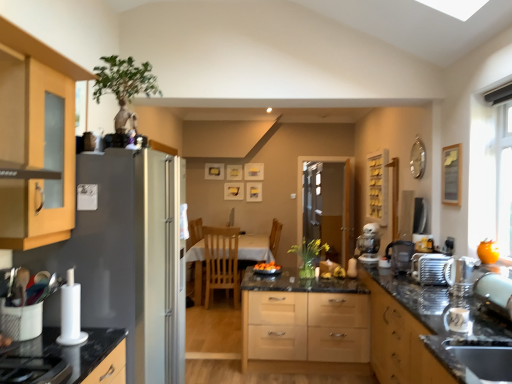
What do you see at coordinates (451, 174) in the screenshot? I see `wooden picture frame at upper right, positioned as the 1th picture frame in front-to-back order` at bounding box center [451, 174].

The height and width of the screenshot is (384, 512). Identify the location of white plastic coffee machine at right. (369, 244).

Describe the element at coordinates (255, 248) in the screenshot. This screenshot has height=384, width=512. I see `white glossy table at center` at that location.

In order to click on black granite toaster at right in this screenshot , I will do click(x=407, y=330).

The width and height of the screenshot is (512, 384). What do you see at coordinates (377, 187) in the screenshot? I see `wooden cabinet at upper center, the first cabinetry positioned from the right` at bounding box center [377, 187].

At what (x,y) coordinates should I click in order to perform the action: click on wooden picture frame at upper right, which is counted as the 1th picture frame, starting from the right. Please return your answer as a coordinate pair (x, y). The image size is (512, 384). Looking at the image, I should click on point(451,174).

From a real-world perspective, is light wood drawer at center below wooden picture frame at upper right, the 3th picture frame viewed from the back?

Yes.

Where is `drawer behind the wooden picture frame at upper right, placed as the third picture frame when sorted from left to right`? The width and height of the screenshot is (512, 384). drawer behind the wooden picture frame at upper right, placed as the third picture frame when sorted from left to right is located at coordinates (306, 326).

Can you tell me how much light wood drawer at center and wooden picture frame at upper right, which is counted as the 1th picture frame, starting from the right, differ in facing direction?

They differ by 90 degrees in their facing directions.

In the image, is light wood drawer at center on the left side or the right side of wooden picture frame at upper right, the 3th picture frame viewed from the back?

In the image, light wood drawer at center appears on the left side of wooden picture frame at upper right, the 3th picture frame viewed from the back.

Between satin silver refrigerator at left and wooden picture frame at upper right, placed as the third picture frame when sorted from left to right, which one has more height?

satin silver refrigerator at left.

Does point (66, 251) come behind point (460, 198)?

No, it is not.

Is satin silver refrigerator at left positioned with its back to wooden picture frame at upper right, placed as the third picture frame when sorted from left to right?

satin silver refrigerator at left is not turned away from wooden picture frame at upper right, placed as the third picture frame when sorted from left to right.

How many degrees apart are the facing directions of satin silver refrigerator at left and wooden picture frame at upper right, the 3th picture frame viewed from the back?

They differ by 180 degrees in their facing directions.

How different are the orientations of light wood chair at center and matte wood cabinet at left, the second cabinetry positioned from the right, in degrees?

The facing directions of light wood chair at center and matte wood cabinet at left, the second cabinetry positioned from the right, are 90 degrees apart.

Is light wood chair at center turned away from matte wood cabinet at left, the 1th cabinetry when ordered from front to back?

Yes, light wood chair at center is positioned with its back facing matte wood cabinet at left, the 1th cabinetry when ordered from front to back.

Considering the relative sizes of light wood chair at center and matte wood cabinet at left, marked as the second cabinetry in a back-to-front arrangement, in the image provided, is light wood chair at center taller than matte wood cabinet at left, marked as the second cabinetry in a back-to-front arrangement,?

Correct, light wood chair at center is much taller as matte wood cabinet at left, marked as the second cabinetry in a back-to-front arrangement.

Can you confirm if light wood chair at center is thinner than matte wood cabinet at left, the second cabinetry positioned from the right?

Yes, light wood chair at center is thinner than matte wood cabinet at left, the second cabinetry positioned from the right.

Between point (507, 304) and point (378, 225), which one is positioned behind?

The point (378, 225) is farther.

Can you confirm if satin silver toaster at right, the third appliance viewed from the left, is positioned to the right of white plastic coffee machine at right?

Yes.

Is satin silver toaster at right, which appears as the 2th appliance when viewed from the back, facing away from white plastic coffee machine at right?

No, white plastic coffee machine at right is not at the back of satin silver toaster at right, which appears as the 2th appliance when viewed from the back.

Is satin silver toaster at right, which appears as the 2th appliance when viewed from the back, spatially inside white plastic coffee machine at right, or outside of it?

satin silver toaster at right, which appears as the 2th appliance when viewed from the back, is spatially situated outside white plastic coffee machine at right.

Is satin silver refrigerator at left spatially inside white plastic coffee machine at right, or outside of it?

satin silver refrigerator at left is spatially situated outside white plastic coffee machine at right.

Is satin silver refrigerator at left oriented towards white plastic coffee machine at right?

No, satin silver refrigerator at left is not facing towards white plastic coffee machine at right.

How distant is satin silver refrigerator at left from white plastic coffee machine at right?

satin silver refrigerator at left and white plastic coffee machine at right are 7.71 feet apart.

Is satin silver refrigerator at left wider than white plastic coffee machine at right?

Correct, the width of satin silver refrigerator at left exceeds that of white plastic coffee machine at right.

Can you tell me how much black granite toaster at right and orange matte bowl at center differ in facing direction?

The angular difference between black granite toaster at right and orange matte bowl at center is 87 degrees.

Looking at this image, can you confirm if black granite toaster at right is positioned to the left of orange matte bowl at center?

No.

The image size is (512, 384). I want to click on countertop on the right side of orange matte bowl at center, so click(407, 330).

Between black granite toaster at right and orange matte bowl at center, which one has smaller size?

Smaller between the two is orange matte bowl at center.

Is white glossy table at center further to the viewer compared to wooden picture frame at center, which is the third picture frame from right to left?

No.

From the image's perspective, who appears lower, white glossy table at center or wooden picture frame at center, positioned as the 1th picture frame in back-to-front order?

white glossy table at center.

Which of these two, white glossy table at center or wooden picture frame at center, arranged as the third picture frame when viewed from the front, is bigger?

With larger size is white glossy table at center.

You are a GUI agent. You are given a task and a screenshot of the screen. Output one action in this format:
    pyautogui.click(x=<x>, y=<y>)
    Task: Click on the picture frame in front of the light wood drawer at center
    
    Given the screenshot: What is the action you would take?
    pyautogui.click(x=451, y=174)

This screenshot has height=384, width=512. I want to click on refrigerator below the wooden picture frame at upper right, positioned as the 1th picture frame in front-to-back order (from a real-world perspective), so click(130, 257).

Based on their spatial positions, is satin silver sink at lower right or satin silver toaster at right, positioned as the first appliance in back-to-front order, closer to matte white picture frame at center, placed as the 2th picture frame when sorted from front to back?

satin silver toaster at right, positioned as the first appliance in back-to-front order.

Based on their spatial positions, is orange matte bowl at center or translucent glass vase at center closer to wooden picture frame at center, arranged as the third picture frame when viewed from the front?

The object closer to wooden picture frame at center, arranged as the third picture frame when viewed from the front, is translucent glass vase at center.

Estimate the real-world distances between objects in this image. Which object is further from orange matte bowl at center, translucent glass vase at center or satin silver toaster at right, the third appliance viewed from the left?

satin silver toaster at right, the third appliance viewed from the left, lies further to orange matte bowl at center than the other object.

Looking at the image, which one is located closer to satin silver toaster at right, which is the 2th appliance in left-to-right order, clear glass screen door at center or light wood chair at center?

light wood chair at center is positioned closer to the anchor satin silver toaster at right, which is the 2th appliance in left-to-right order.

From the image, which object appears to be nearer to satin silver sink at lower right, satin silver toaster at right, positioned as the first appliance in back-to-front order, or satin silver toaster at right?

satin silver toaster at right is positioned closer to the anchor satin silver sink at lower right.

Based on the photo, considering their positions, is black granite toaster at right positioned closer to wooden cabinet at upper center, which appears as the second cabinetry when viewed from the front, than satin silver toaster at right, positioned as the first appliance in back-to-front order?

satin silver toaster at right, positioned as the first appliance in back-to-front order.

Looking at the image, which one is located closer to black granite toaster at right, white plastic paper towel holder at left, which is the third appliance from right to left, or clear glass screen door at center?

white plastic paper towel holder at left, which is the third appliance from right to left.

Which object lies nearer to the anchor point white glossy table at center, clear glass screen door at center or satin silver toaster at right, which appears as the 2th appliance when viewed from the back?

clear glass screen door at center.

At what (x,y) coordinates should I click in order to perform the action: click on kitchen appliance located between matte wood cabinet at left, marked as the second cabinetry in a back-to-front arrangement, and clear glass screen door at center in the depth direction. Please return your answer as a coordinate pair (x, y). Looking at the image, I should click on (429, 268).

I want to click on fruit between satin silver toaster at right, which appears as the 3th appliance when viewed from the front, and matte white picture frame at center, placed as the 2th picture frame when sorted from front to back, along the z-axis, so click(267, 266).

The width and height of the screenshot is (512, 384). Identify the location of picture frame located between wooden picture frame at center, which is the 1th picture frame in left-to-right order, and clear glass screen door at center in the left-right direction. (254, 192).

Find the location of a particular element. Image resolution: width=512 pixels, height=384 pixels. picture frame between satin silver toaster at right, which appears as the 2th appliance when viewed from the back, and wooden cabinet at upper center, the first cabinetry positioned from the right, in the front-back direction is located at coordinates (451, 174).